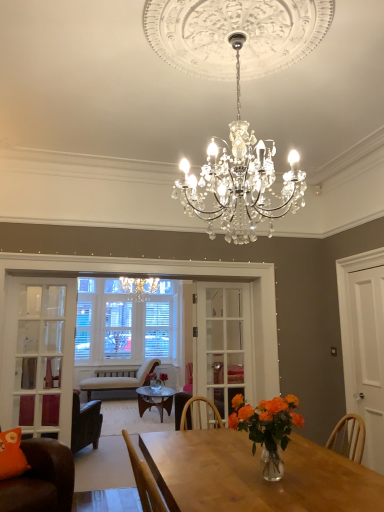
Question: Is white matte door at right thinner than white glass door at left, arranged as the 1th glass door when viewed from the left?

Choices:
 (A) no
 (B) yes

Answer: (B)

Question: Is white matte door at right shorter than white glass door at left, which is the second glass door in back-to-front order?

Choices:
 (A) no
 (B) yes

Answer: (B)

Question: Considering the relative sizes of white matte door at right and white glass door at left, arranged as the 2th glass door when viewed from the right, in the image provided, is white matte door at right smaller than white glass door at left, arranged as the 2th glass door when viewed from the right,?

Choices:
 (A) yes
 (B) no

Answer: (A)

Question: Is white matte door at right positioned before white glass door at left, which is counted as the first glass door, starting from the front?

Choices:
 (A) yes
 (B) no

Answer: (A)

Question: From a real-world perspective, does white matte door at right sit lower than white glass door at left, which is counted as the first glass door, starting from the front?

Choices:
 (A) yes
 (B) no

Answer: (B)

Question: Is white matte door at right at the right side of white glass door at left, which is counted as the first glass door, starting from the front?

Choices:
 (A) no
 (B) yes

Answer: (B)

Question: Does clear glass door at center, placed as the 1th glass door when sorted from back to front, have a smaller size compared to white glass door at left, arranged as the 2th glass door when viewed from the right?

Choices:
 (A) yes
 (B) no

Answer: (A)

Question: Can you confirm if clear glass door at center, which is the 1th glass door in right-to-left order, is thinner than white glass door at left, which is counted as the first glass door, starting from the front?

Choices:
 (A) no
 (B) yes

Answer: (B)

Question: Considering the relative positions of clear glass door at center, placed as the 1th glass door when sorted from back to front, and white glass door at left, which is counted as the first glass door, starting from the front, in the image provided, is clear glass door at center, placed as the 1th glass door when sorted from back to front, to the left of white glass door at left, which is counted as the first glass door, starting from the front, from the viewer's perspective?

Choices:
 (A) no
 (B) yes

Answer: (A)

Question: Can you confirm if clear glass door at center, acting as the 2th glass door starting from the front, is bigger than white glass door at left, arranged as the 1th glass door when viewed from the left?

Choices:
 (A) yes
 (B) no

Answer: (B)

Question: From a real-world perspective, is clear glass door at center, placed as the 1th glass door when sorted from back to front, beneath white glass door at left, which is the second glass door in back-to-front order?

Choices:
 (A) no
 (B) yes

Answer: (A)

Question: Is clear glass door at center, placed as the 1th glass door when sorted from back to front, oriented away from white glass door at left, which is counted as the first glass door, starting from the front?

Choices:
 (A) no
 (B) yes

Answer: (A)

Question: Considering the relative sizes of orange matte vase at center and orange fabric pillow at lower left in the image provided, is orange matte vase at center shorter than orange fabric pillow at lower left?

Choices:
 (A) yes
 (B) no

Answer: (B)